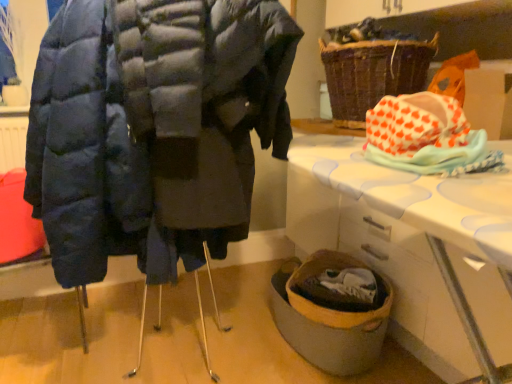
Question: Does white plastic table at lower right contain matte blue puffer coat at left?

Choices:
 (A) no
 (B) yes

Answer: (A)

Question: Is white plastic table at lower right outside matte blue puffer coat at left?

Choices:
 (A) yes
 (B) no

Answer: (A)

Question: Is white plastic table at lower right positioned behind matte blue puffer coat at left?

Choices:
 (A) yes
 (B) no

Answer: (A)

Question: Considering the relative sizes of white plastic table at lower right and matte blue puffer coat at left in the image provided, is white plastic table at lower right wider than matte blue puffer coat at left?

Choices:
 (A) no
 (B) yes

Answer: (A)

Question: From a real-world perspective, is white plastic table at lower right physically below matte blue puffer coat at left?

Choices:
 (A) yes
 (B) no

Answer: (A)

Question: Is the depth of white plastic table at lower right less than that of matte blue puffer coat at left?

Choices:
 (A) no
 (B) yes

Answer: (A)

Question: Can you confirm if matte blue puffer coat at left is wider than white plastic table at lower right?

Choices:
 (A) no
 (B) yes

Answer: (B)

Question: From the image's perspective, is matte blue puffer coat at left beneath white plastic table at lower right?

Choices:
 (A) yes
 (B) no

Answer: (B)

Question: Is matte blue puffer coat at left bigger than white plastic table at lower right?

Choices:
 (A) no
 (B) yes

Answer: (B)

Question: Is the position of matte blue puffer coat at left less distant than that of white plastic table at lower right?

Choices:
 (A) yes
 (B) no

Answer: (A)

Question: Can you confirm if matte blue puffer coat at left is thinner than white plastic table at lower right?

Choices:
 (A) no
 (B) yes

Answer: (A)

Question: From a real-world perspective, is matte blue puffer coat at left located beneath white plastic table at lower right?

Choices:
 (A) yes
 (B) no

Answer: (B)

Question: Considering the relative sizes of matte blue puffer coat at left and orange heart-patterned fabric at upper right in the image provided, is matte blue puffer coat at left smaller than orange heart-patterned fabric at upper right?

Choices:
 (A) yes
 (B) no

Answer: (B)